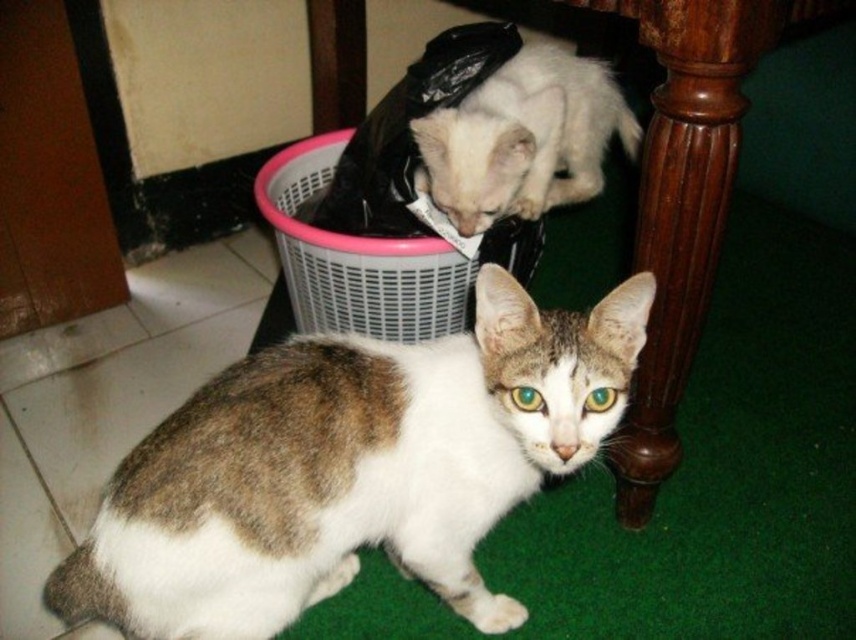
Question: Can you confirm if wooden at lower center is positioned below pink plastic basket at upper center?

Choices:
 (A) no
 (B) yes

Answer: (B)

Question: Is the position of white matte plastic bag at upper center more distant than that of pink plastic basket at upper center?

Choices:
 (A) no
 (B) yes

Answer: (B)

Question: Which object is positioned closest to the pink plastic basket at upper center?

Choices:
 (A) wooden at lower center
 (B) white matte plastic bag at upper center
 (C) brown and white fur cat at lower center

Answer: (B)

Question: Which of the following is the farthest from the observer?

Choices:
 (A) (709, 40)
 (B) (401, 240)

Answer: (B)

Question: Which point is farther to the camera?

Choices:
 (A) (189, 422)
 (B) (519, 118)
 (C) (688, 355)

Answer: (B)

Question: From the image, what is the correct spatial relationship of brown and white fur cat at lower center in relation to pink plastic basket at upper center?

Choices:
 (A) left
 (B) right

Answer: (A)